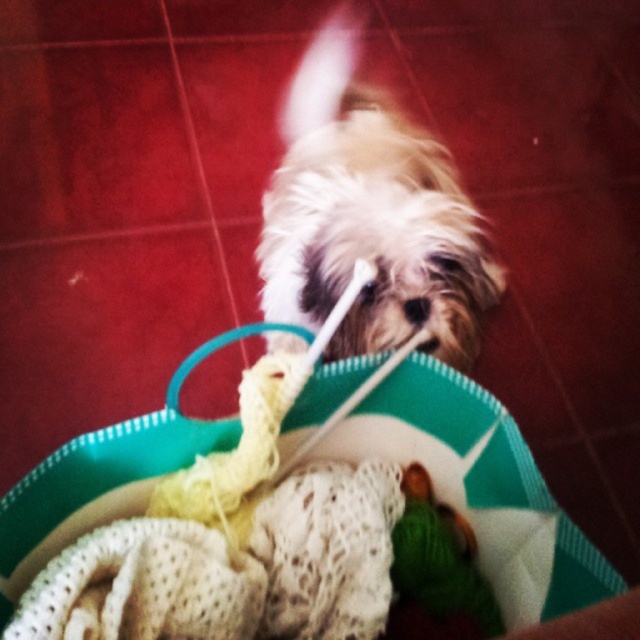
Can you confirm if fluffy white fur at center is positioned to the left of green fabric toy at center?

Yes, fluffy white fur at center is to the left of green fabric toy at center.

Between fluffy white fur at center and green fabric toy at center, which one has more height?

Standing taller between the two is fluffy white fur at center.

Locate an element on the screen. This screenshot has height=640, width=640. fluffy white fur at center is located at coordinates 369,216.

At what (x,y) coordinates should I click in order to perform the action: click on fluffy white fur at center. Please return your answer as a coordinate pair (x, y). Looking at the image, I should click on (369, 216).

Between point (408, 120) and point (216, 541), which one is positioned behind?

The point (408, 120) is more distant.

Can you confirm if fluffy white fur at center is shorter than white knitted blanket at center?

Incorrect, fluffy white fur at center's height does not fall short of white knitted blanket at center's.

Which is behind, point (394, 220) or point (90, 593)?

The point (394, 220) is more distant.

Image resolution: width=640 pixels, height=640 pixels. Find the location of `fluffy white fur at center`. fluffy white fur at center is located at coordinates (369, 216).

Which is more to the left, white knitted blanket at center or green fabric toy at center?

Positioned to the left is white knitted blanket at center.

Is point (378, 502) behind point (433, 582)?

No, it is not.

Find the location of a particular element. This screenshot has height=640, width=640. white knitted blanket at center is located at coordinates (230, 570).